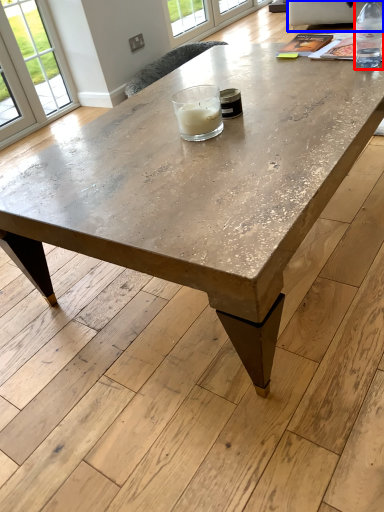
Question: Among these objects, which one is nearest to the camera, bottle (highlighted by a red box) or couch (highlighted by a blue box)?

Choices:
 (A) bottle
 (B) couch

Answer: (A)